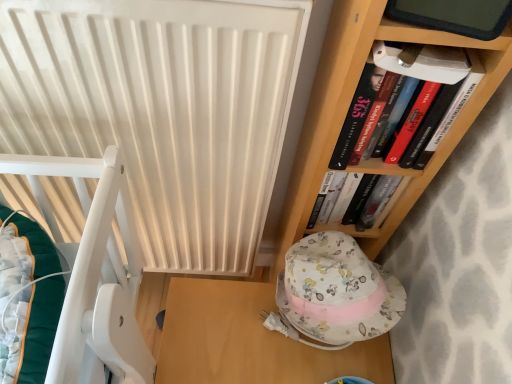
Question: Considering the relative sizes of hardcover book at upper right and white matte radiator at center in the image provided, is hardcover book at upper right thinner than white matte radiator at center?

Choices:
 (A) no
 (B) yes

Answer: (B)

Question: Is hardcover book at upper right aimed at white matte radiator at center?

Choices:
 (A) yes
 (B) no

Answer: (B)

Question: Is hardcover book at upper right positioned behind white matte radiator at center?

Choices:
 (A) no
 (B) yes

Answer: (B)

Question: Considering the relative positions of hardcover book at upper right and white matte radiator at center in the image provided, is hardcover book at upper right in front of white matte radiator at center?

Choices:
 (A) no
 (B) yes

Answer: (A)

Question: Is hardcover book at upper right positioned beyond the bounds of white matte radiator at center?

Choices:
 (A) yes
 (B) no

Answer: (A)

Question: Is hardcover book at upper right wider than white matte radiator at center?

Choices:
 (A) yes
 (B) no

Answer: (B)

Question: Does white matte radiator at center have a larger size compared to hardcover book at upper right?

Choices:
 (A) yes
 (B) no

Answer: (A)

Question: Would you say white matte radiator at center is a long distance from hardcover book at upper right?

Choices:
 (A) no
 (B) yes

Answer: (A)

Question: Does white matte radiator at center lie behind hardcover book at upper right?

Choices:
 (A) no
 (B) yes

Answer: (A)

Question: Is white matte radiator at center taller than hardcover book at upper right?

Choices:
 (A) no
 (B) yes

Answer: (B)

Question: From a real-world perspective, is white matte radiator at center on hardcover book at upper right?

Choices:
 (A) yes
 (B) no

Answer: (B)

Question: From a real-world perspective, is white matte radiator at center located beneath hardcover book at upper right?

Choices:
 (A) no
 (B) yes

Answer: (B)

Question: Is wooden table at lower center turned away from white matte radiator at center?

Choices:
 (A) no
 (B) yes

Answer: (A)